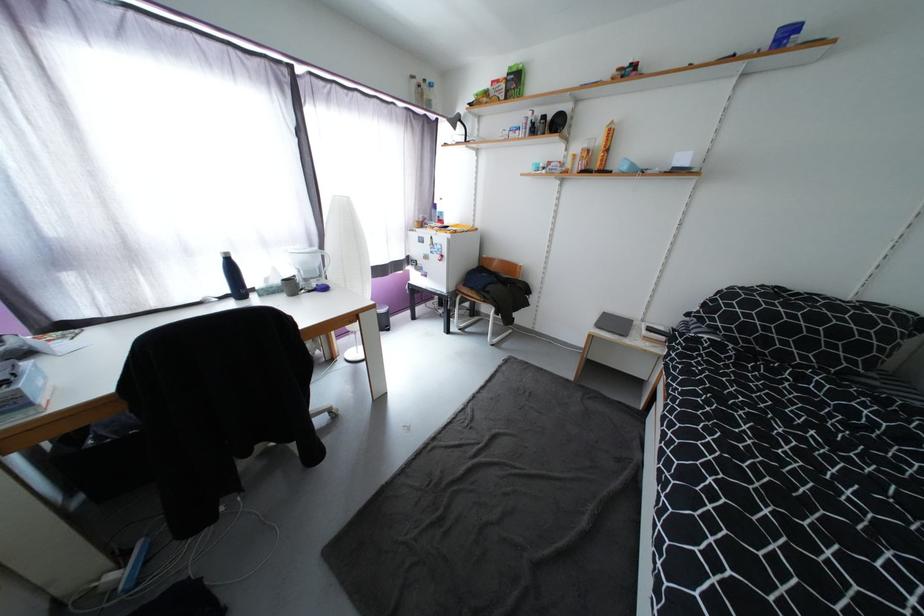
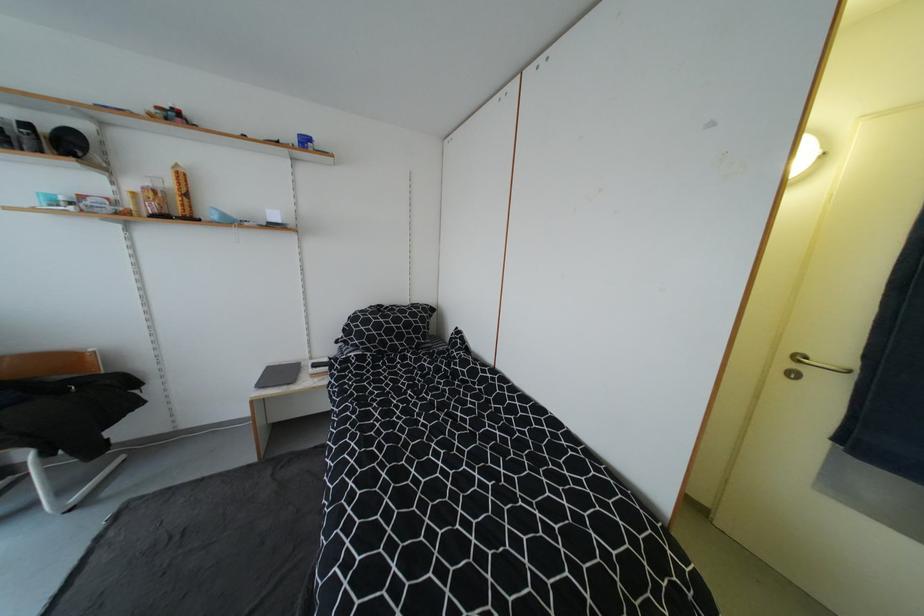
Find the pixel in the second image that matches (x=537, y=171) in the first image.

(43, 204)